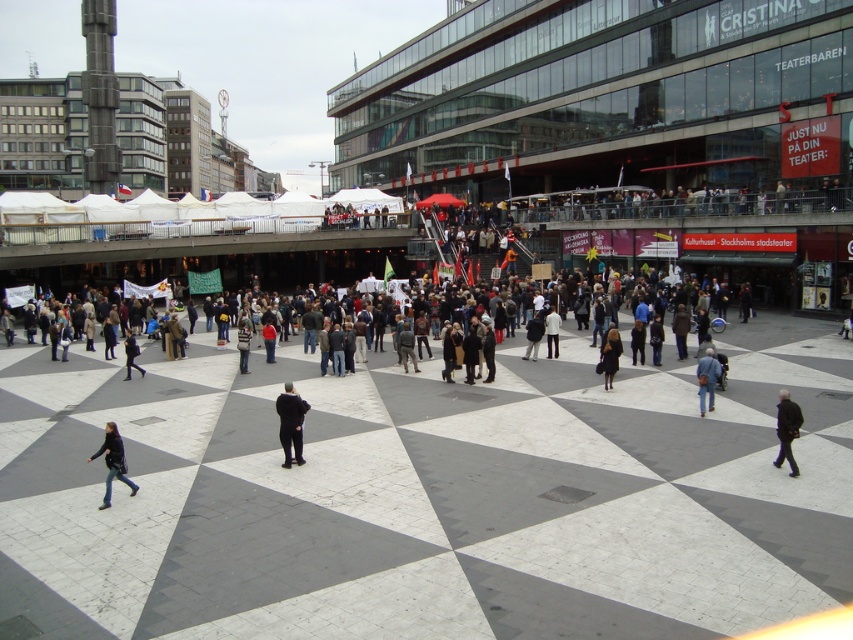
What do you see at coordinates (706, 378) in the screenshot?
I see `blue denim jeans at center` at bounding box center [706, 378].

Between blue denim jeans at center and dark gray pants at lower left, which one appears on the left side from the viewer's perspective?

dark gray pants at lower left

Does point (701, 356) come behind point (132, 365)?

Yes, point (701, 356) is farther from viewer.

Image resolution: width=853 pixels, height=640 pixels. What are the coordinates of `blue denim jeans at center` in the screenshot? It's located at (706, 378).

Who is higher up, denim jeans at lower left or blue denim jeans at center?

blue denim jeans at center is above.

Does denim jeans at lower left have a larger size compared to blue denim jeans at center?

Yes, denim jeans at lower left is bigger than blue denim jeans at center.

The image size is (853, 640). Find the location of `denim jeans at lower left`. denim jeans at lower left is located at coordinates (113, 461).

Can you confirm if dark blue coat at center is bigger than blue denim jeans at center?

Actually, dark blue coat at center might be smaller than blue denim jeans at center.

From the picture: Which is below, dark blue coat at center or blue denim jeans at center?

Positioned lower is dark blue coat at center.

Locate an element on the screen. The image size is (853, 640). dark blue coat at center is located at coordinates (289, 422).